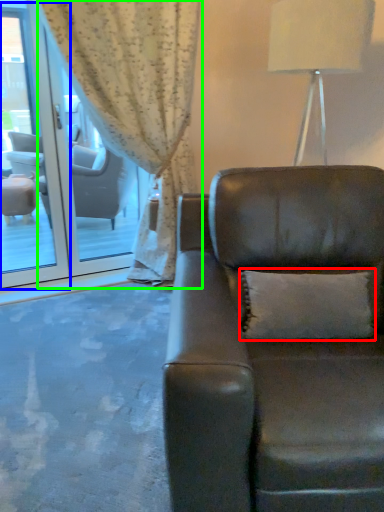
Question: Estimate the real-world distances between objects in this image. Which object is closer to pillow (highlighted by a red box), screen door (highlighted by a blue box) or curtain (highlighted by a green box)?

Choices:
 (A) screen door
 (B) curtain

Answer: (B)